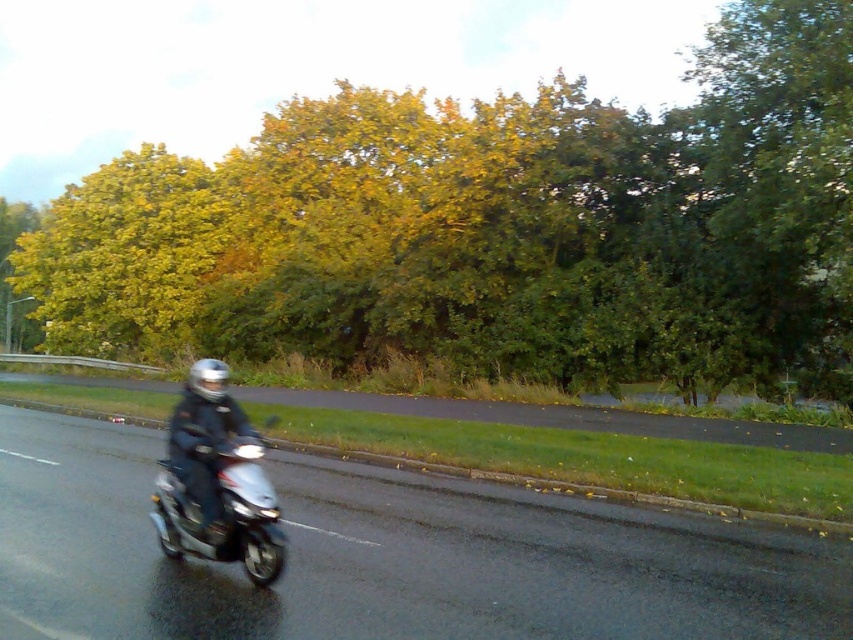
Based on the photo, you are a delivery person who needs to pass through a narrow alley that is only wide enough for one scooter. You see both the metallic silver scooter at center and the shiny silver scooter at center. Which scooter should you choose to ensure you can fit through the alley?

The shiny silver scooter at center is narrower than the metallic silver scooter at center, so you should choose the shiny silver scooter at center to fit through the narrow alley.

You are a pedestrian standing on the sidewalk next to the road. You see both the metallic silver scooter at center and the shiny silver scooter at center. Which scooter is closer to you?

The metallic silver scooter at center is closer to you than the shiny silver scooter at center.